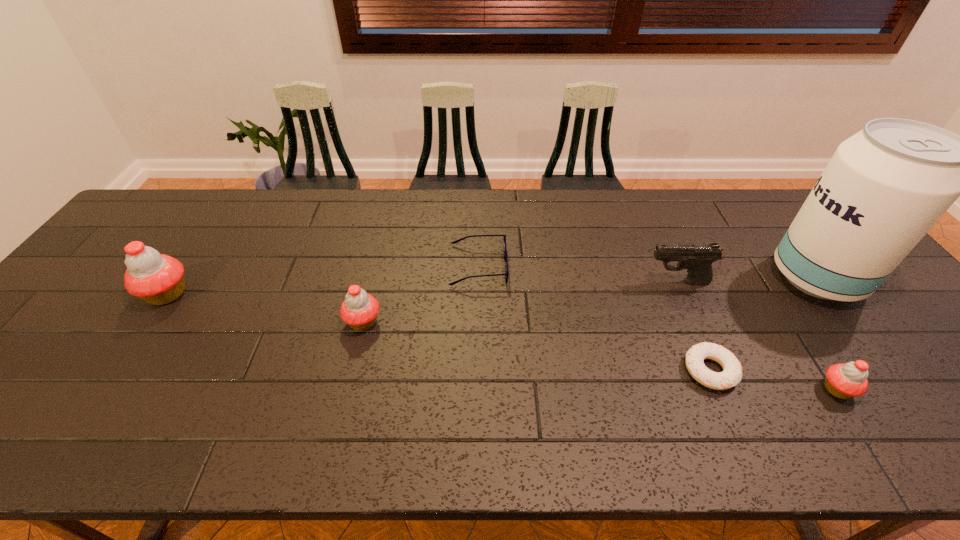
Find the location of a particular element. empty space between the tallest object and the pistol is located at coordinates (747, 280).

Locate an element on the screen. The image size is (960, 540). free space between the tallest object and the pistol is located at coordinates (747, 280).

The height and width of the screenshot is (540, 960). In order to click on free space between the doughnut and the shortest cupcake in this screenshot , I will do `click(774, 380)`.

At what (x,y) coordinates should I click in order to perform the action: click on vacant space that is in between the shortest object and the sixth object from right to left. Please return your answer as a coordinate pair (x, y). Image resolution: width=960 pixels, height=540 pixels. Looking at the image, I should click on (537, 346).

Where is `free point between the second cupcake from left to right and the pistol`? The width and height of the screenshot is (960, 540). free point between the second cupcake from left to right and the pistol is located at coordinates (520, 302).

Locate an element on the screen. vacant area that lies between the alcohol and the tallest cupcake is located at coordinates (492, 286).

Identify which object is the sixth closest to the spectacles. Please provide its 2D coordinates. Your answer should be formatted as a tuple, i.e. [(x, y)], where the tuple contains the x and y coordinates of a point satisfying the conditions above.

[(884, 188)]

At what (x,y) coordinates should I click in order to perform the action: click on object identified as the fifth closest to the second cupcake from right to left. Please return your answer as a coordinate pair (x, y). Looking at the image, I should click on (844, 381).

Locate which cupcake ranks in proximity to the second cupcake from left to right. Please provide its 2D coordinates. Your answer should be formatted as a tuple, i.e. [(x, y)], where the tuple contains the x and y coordinates of a point satisfying the conditions above.

[(158, 279)]

Locate which cupcake ranks third in proximity to the pistol. Please provide its 2D coordinates. Your answer should be formatted as a tuple, i.e. [(x, y)], where the tuple contains the x and y coordinates of a point satisfying the conditions above.

[(158, 279)]